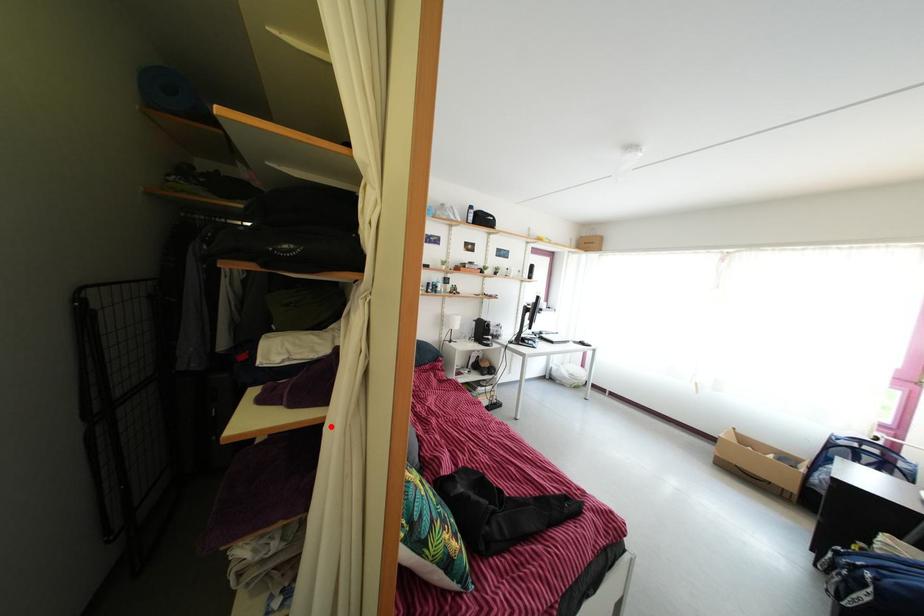
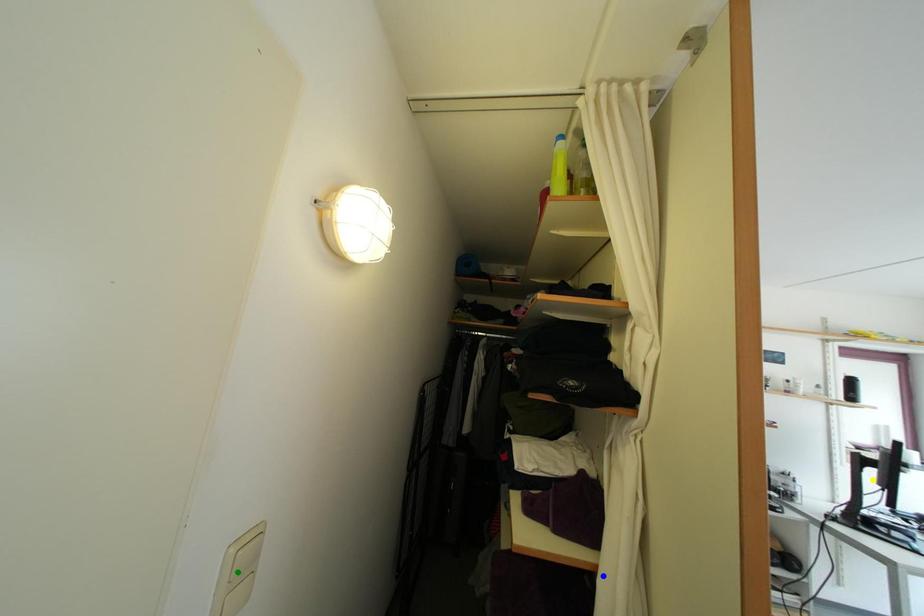
Question: I am providing you with two images of the same scene from different viewpoints. A red point is marked on the first image. You are given multiple points on the second image. Which spot in image 2 lines up with the point in image 1?

Choices:
 (A) green point
 (B) yellow point
 (C) blue point

Answer: (C)